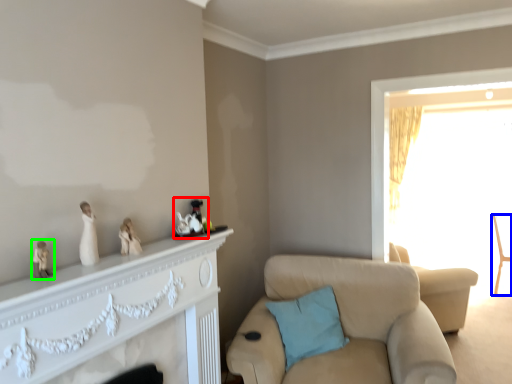
Question: Which object is the farthest from toy (highlighted by a red box)? Choose among these: chair (highlighted by a blue box) or toy (highlighted by a green box).

Choices:
 (A) chair
 (B) toy

Answer: (A)